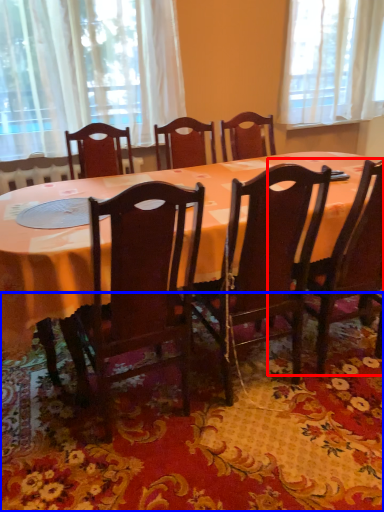
Question: Which of the following is the farthest to the observer, chair (highlighted by a red box) or mat (highlighted by a blue box)?

Choices:
 (A) chair
 (B) mat

Answer: (A)